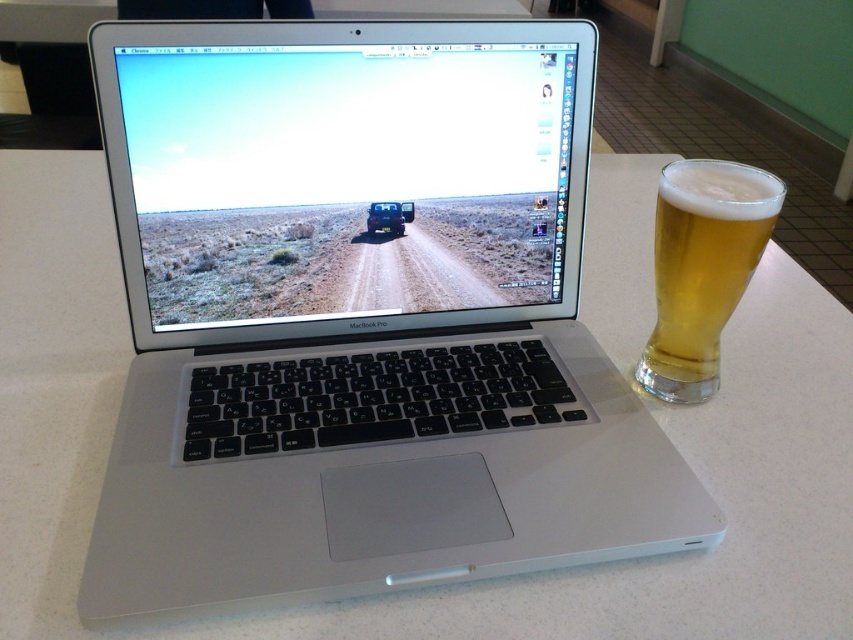
You are a delivery robot with a 35 cm wide package. You need to place it on the surface where the silver metallic laptop at center is located. Can you place the package without it overlapping the laptop?

The silver metallic laptop at center is 34.70 centimeters away from the viewer. Since the package is 35 cm wide, it might not fit if the laptop is occupying space closer than that. However, the description only mentions distance, not width. Therefore, the answer cannot be determined based on the given information.

You are organizing a study space and need to place both the silver metallic laptop at center and the golden glass beer at right on the desk. If the desk has limited space, which item should you prioritize keeping based on their sizes?

The silver metallic laptop at center is larger in size than the golden glass beer at right, so you should prioritize keeping the silver metallic laptop at center to accommodate its larger size.

You are a delivery robot with a 10 inch wide package. You need to place it on the desk between the golden glass beer at right and the metallic blue jeep at center. Can you fit the package between them without touching either object?

The golden glass beer at right and metallic blue jeep at center are 8.52 inches apart from each other. Since the package is 10 inches wide, it cannot fit between them without overlapping or touching either object.